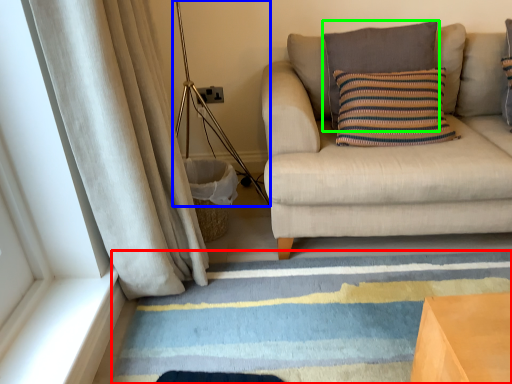
Question: Which is farther away from doormat (highlighted by a red box)? lamp (highlighted by a blue box) or pillow (highlighted by a green box)?

Choices:
 (A) lamp
 (B) pillow

Answer: (B)